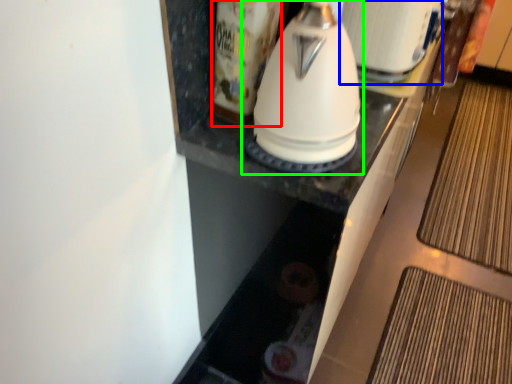
Question: Which is farther away from beverage (highlighted by a red box)? appliance (highlighted by a blue box) or kitchen appliance (highlighted by a green box)?

Choices:
 (A) appliance
 (B) kitchen appliance

Answer: (A)